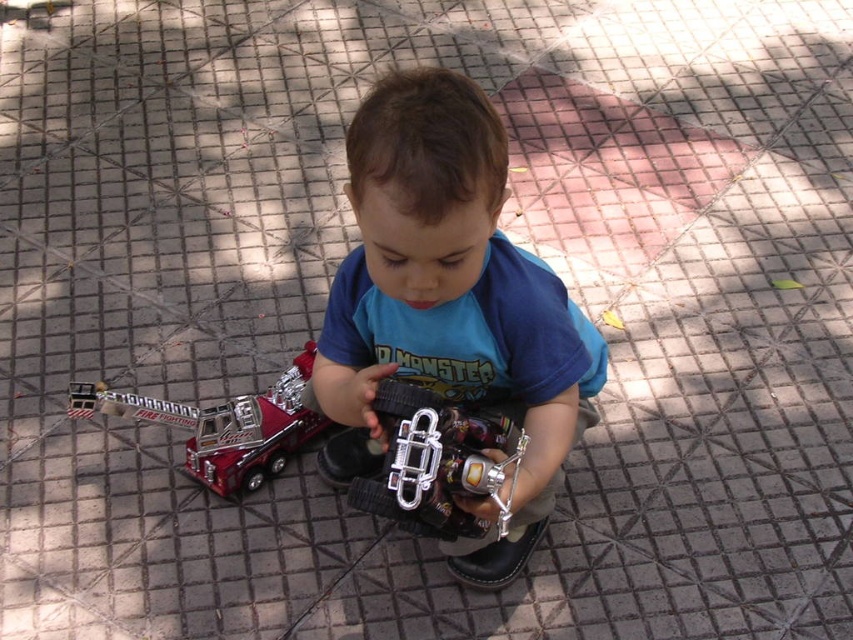
You are a photographer taking a picture of the scene. You notice two points in the image labeled as point (415, 99) and point (299, 388). Which point will appear larger in your photo?

Point (415, 99) is closer to the camera than point (299, 388), so it will appear larger in the photo.